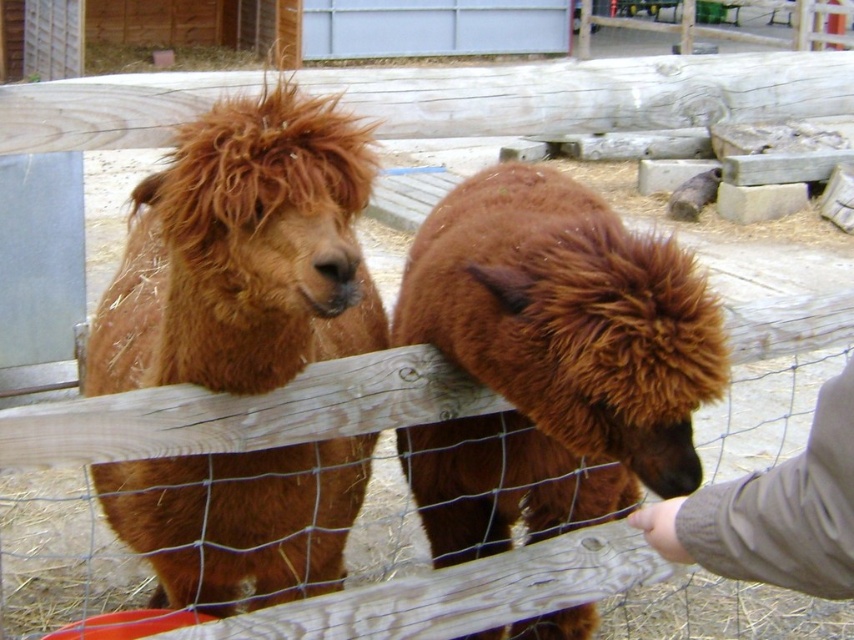
Question: Among these points, which one is nearest to the camera?

Choices:
 (A) (847, 364)
 (B) (402, 310)
 (C) (132, 310)

Answer: (A)

Question: Does brown fluffy alpaca at left have a lesser width compared to wooden fence at center?

Choices:
 (A) no
 (B) yes

Answer: (B)

Question: Is brown fluffy alpaca at left above wooden fence at center?

Choices:
 (A) yes
 (B) no

Answer: (A)

Question: Which object is the closest to the brown fluffy alpaca at left?

Choices:
 (A) brown fluffy camel at center
 (B) wooden fence at center

Answer: (A)

Question: Which point is farther to the camera?

Choices:
 (A) click(x=703, y=317)
 (B) click(x=776, y=545)
 (C) click(x=214, y=563)
 (D) click(x=781, y=422)

Answer: (D)

Question: Can you confirm if brown fluffy camel at center is bigger than knitted gray sweater at lower right?

Choices:
 (A) no
 (B) yes

Answer: (B)